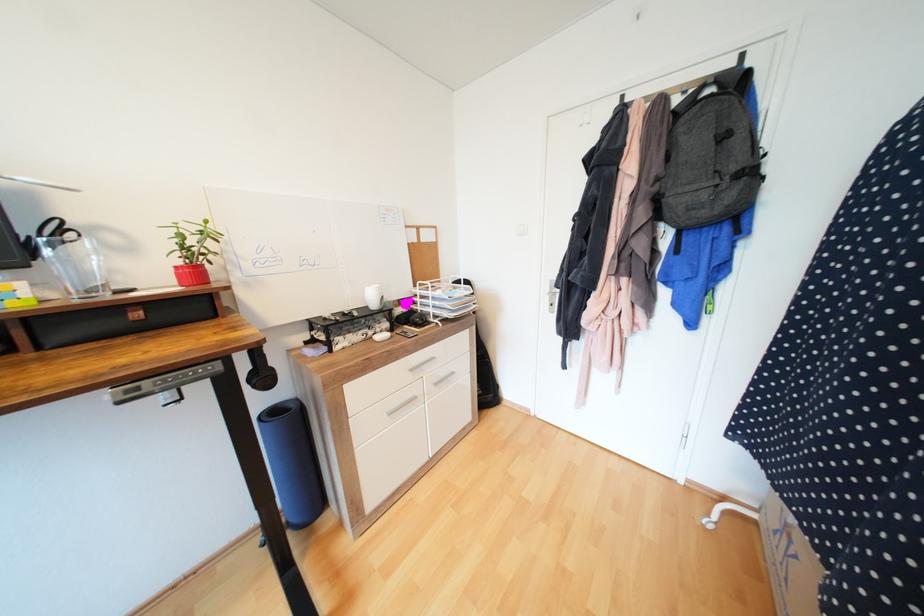
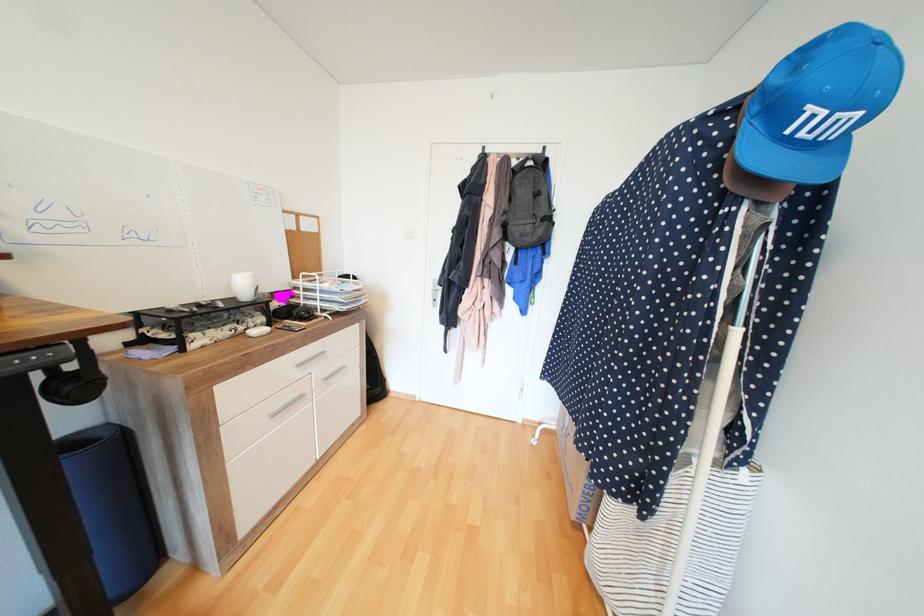
In the second image, find the point that corresponds to (272,379) in the first image.

(88, 387)